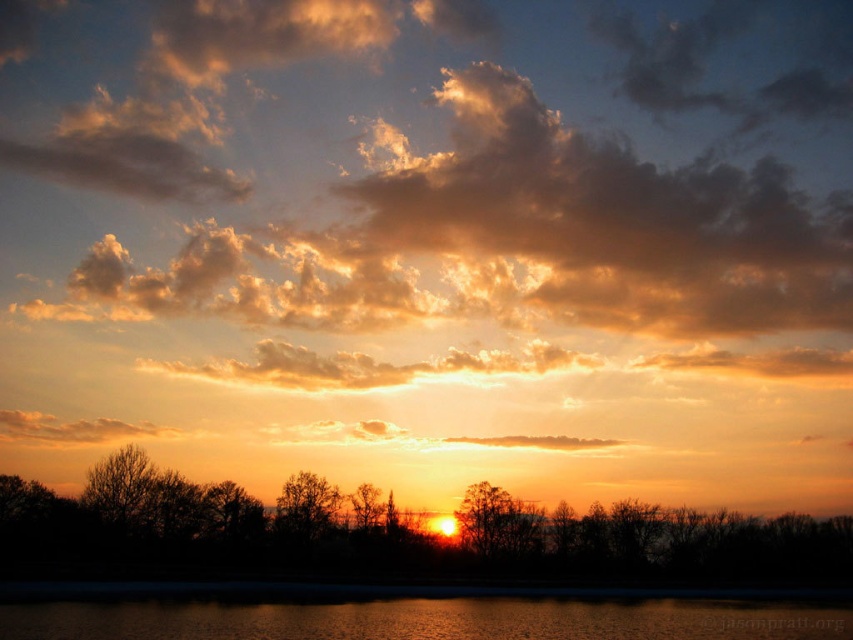
Consider the image. You are standing at the lakeside and see the golden fluffy cloud at upper center and the silhouette tree at center. Which object is positioned to the right side of the other?

The golden fluffy cloud at upper center is positioned to the right of the silhouette tree at center.

You are an artist trying to paint the sunset scene. You notice the golden fluffy cloud at upper center and the brown matte tree at center. Which object should you paint first if you want to follow the rule of painting larger objects before smaller ones?

The golden fluffy cloud at upper center is larger than the brown matte tree at center, so you should paint the golden fluffy cloud at upper center first.

You are an artist trying to paint the sunset scene. You need to decide which area to focus on first between the golden fluffy cloud at upper center and the glistening water at lower center. Based on their sizes, which one should you paint first if you want to start with the larger one?

The golden fluffy cloud at upper center might be wider than glistening water at lower center, so you should paint the golden fluffy cloud at upper center first.